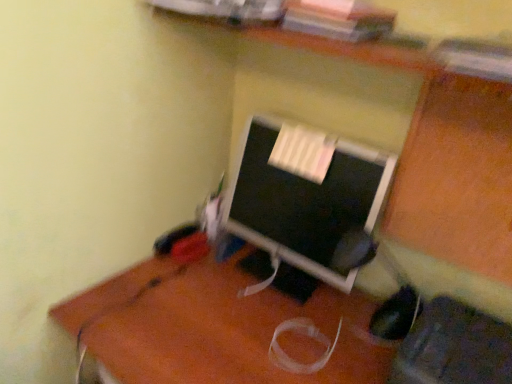
Question: From the image's perspective, is black fabric computer chair at lower right on brown wooden desk at center?

Choices:
 (A) yes
 (B) no

Answer: (A)

Question: Does black fabric computer chair at lower right have a greater height compared to brown wooden desk at center?

Choices:
 (A) no
 (B) yes

Answer: (A)

Question: Does black fabric computer chair at lower right touch brown wooden desk at center?

Choices:
 (A) yes
 (B) no

Answer: (B)

Question: Could brown wooden desk at center be considered to be inside black fabric computer chair at lower right?

Choices:
 (A) yes
 (B) no

Answer: (B)

Question: Is the depth of black fabric computer chair at lower right greater than that of brown wooden desk at center?

Choices:
 (A) no
 (B) yes

Answer: (A)

Question: From the image's perspective, would you say black fabric computer chair at lower right is shown under brown wooden desk at center?

Choices:
 (A) no
 (B) yes

Answer: (A)

Question: From a real-world perspective, is black fabric computer chair at lower right positioned over matte black monitor at center based on gravity?

Choices:
 (A) no
 (B) yes

Answer: (A)

Question: Considering the relative sizes of black fabric computer chair at lower right and matte black monitor at center in the image provided, is black fabric computer chair at lower right thinner than matte black monitor at center?

Choices:
 (A) no
 (B) yes

Answer: (A)

Question: Can you confirm if black fabric computer chair at lower right is positioned to the left of matte black monitor at center?

Choices:
 (A) no
 (B) yes

Answer: (A)

Question: Is black fabric computer chair at lower right next to matte black monitor at center and touching it?

Choices:
 (A) yes
 (B) no

Answer: (B)

Question: Is black fabric computer chair at lower right located outside matte black monitor at center?

Choices:
 (A) no
 (B) yes

Answer: (B)

Question: Does black fabric computer chair at lower right turn towards matte black monitor at center?

Choices:
 (A) yes
 (B) no

Answer: (B)

Question: Does brown wooden desk at center have a larger size compared to matte black monitor at center?

Choices:
 (A) yes
 (B) no

Answer: (A)